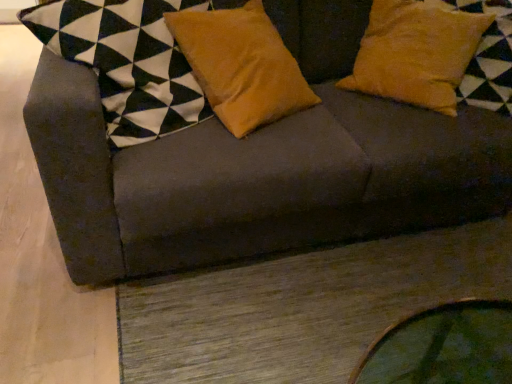
Question: Considering the relative sizes of suede yellow pillow at upper right, the first pillow viewed from the right, and dark gray fabric couch at upper center in the image provided, is suede yellow pillow at upper right, the first pillow viewed from the right, wider than dark gray fabric couch at upper center?

Choices:
 (A) yes
 (B) no

Answer: (B)

Question: From the image's perspective, is suede yellow pillow at upper right, the first pillow viewed from the right, on top of dark gray fabric couch at upper center?

Choices:
 (A) yes
 (B) no

Answer: (A)

Question: From a real-world perspective, is suede yellow pillow at upper right, the first pillow viewed from the right, physically above dark gray fabric couch at upper center?

Choices:
 (A) yes
 (B) no

Answer: (A)

Question: Is dark gray fabric couch at upper center completely or partially inside suede yellow pillow at upper right, the first pillow viewed from the right?

Choices:
 (A) yes
 (B) no

Answer: (B)

Question: Does suede yellow pillow at upper right, which is the 2th pillow in left-to-right order, appear on the left side of dark gray fabric couch at upper center?

Choices:
 (A) no
 (B) yes

Answer: (A)

Question: From a real-world perspective, is velvet orange pillow at center, which is the 2th pillow in right-to-left order, above or below suede yellow pillow at upper right, which is the 2th pillow in left-to-right order?

Choices:
 (A) above
 (B) below

Answer: (B)

Question: From the image's perspective, is velvet orange pillow at center, which is the 2th pillow in right-to-left order, located above or below suede yellow pillow at upper right, which is the 2th pillow in left-to-right order?

Choices:
 (A) below
 (B) above

Answer: (A)

Question: Is velvet orange pillow at center, which is the 2th pillow in right-to-left order, situated inside suede yellow pillow at upper right, the first pillow viewed from the right, or outside?

Choices:
 (A) outside
 (B) inside

Answer: (A)

Question: In terms of width, does velvet orange pillow at center, which is the 2th pillow in right-to-left order, look wider or thinner when compared to suede yellow pillow at upper right, which is the 2th pillow in left-to-right order?

Choices:
 (A) wide
 (B) thin

Answer: (B)

Question: Choose the correct answer: Is dark gray fabric couch at upper center inside suede yellow pillow at upper right, which is the 2th pillow in left-to-right order, or outside it?

Choices:
 (A) inside
 (B) outside

Answer: (B)

Question: Is point (181, 241) closer or farther from the camera than point (395, 39)?

Choices:
 (A) farther
 (B) closer

Answer: (B)

Question: From a real-world perspective, is dark gray fabric couch at upper center above or below suede yellow pillow at upper right, which is the 2th pillow in left-to-right order?

Choices:
 (A) below
 (B) above

Answer: (A)

Question: Considering their positions, is dark gray fabric couch at upper center located in front of or behind suede yellow pillow at upper right, the first pillow viewed from the right?

Choices:
 (A) front
 (B) behind

Answer: (A)

Question: From a real-world perspective, is suede yellow pillow at upper right, the first pillow viewed from the right, above or below velvet orange pillow at center, which is the 2th pillow in right-to-left order?

Choices:
 (A) below
 (B) above

Answer: (B)

Question: In terms of size, does suede yellow pillow at upper right, the first pillow viewed from the right, appear bigger or smaller than velvet orange pillow at center, which appears as the first pillow when viewed from the left?

Choices:
 (A) big
 (B) small

Answer: (A)